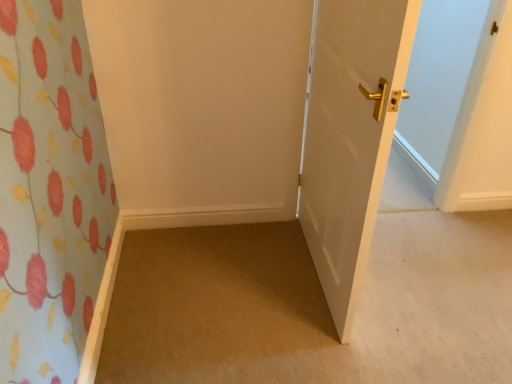
Locate an element on the screen. Image resolution: width=512 pixels, height=384 pixels. vacant space that is to the left of white glossy door at right is located at coordinates (223, 269).